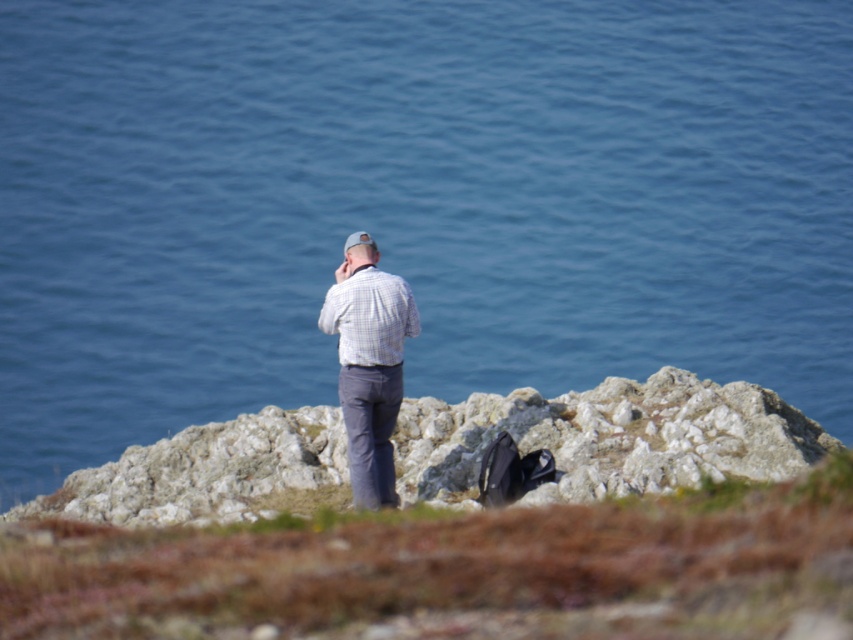
Question: Among these points, which one is farthest from the camera?

Choices:
 (A) (351, 374)
 (B) (752, 410)

Answer: (B)

Question: Which object appears closest to the camera in this image?

Choices:
 (A) white checkered shirt at center
 (B) rugged stone cliff at center

Answer: (B)

Question: Can you confirm if rugged stone cliff at center is positioned to the left of white checkered shirt at center?

Choices:
 (A) no
 (B) yes

Answer: (A)

Question: Does rugged stone cliff at center appear over white checkered shirt at center?

Choices:
 (A) no
 (B) yes

Answer: (A)

Question: Does rugged stone cliff at center appear on the left side of white checkered shirt at center?

Choices:
 (A) yes
 (B) no

Answer: (B)